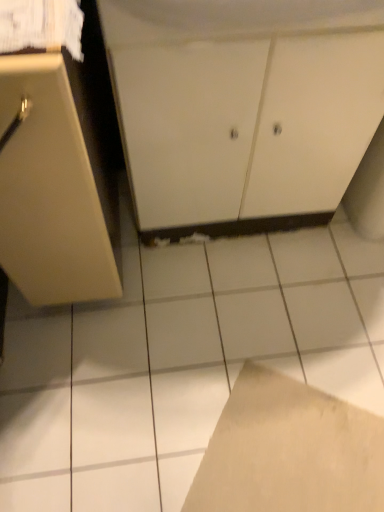
Locate an element on the screen. This screenshot has width=384, height=512. free space that is in between white matte cabinet at center, which is counted as the second cabinetry, starting from the left, and matte beige cabinet at left, which is counted as the 2th cabinetry, starting from the right is located at coordinates pos(197,270).